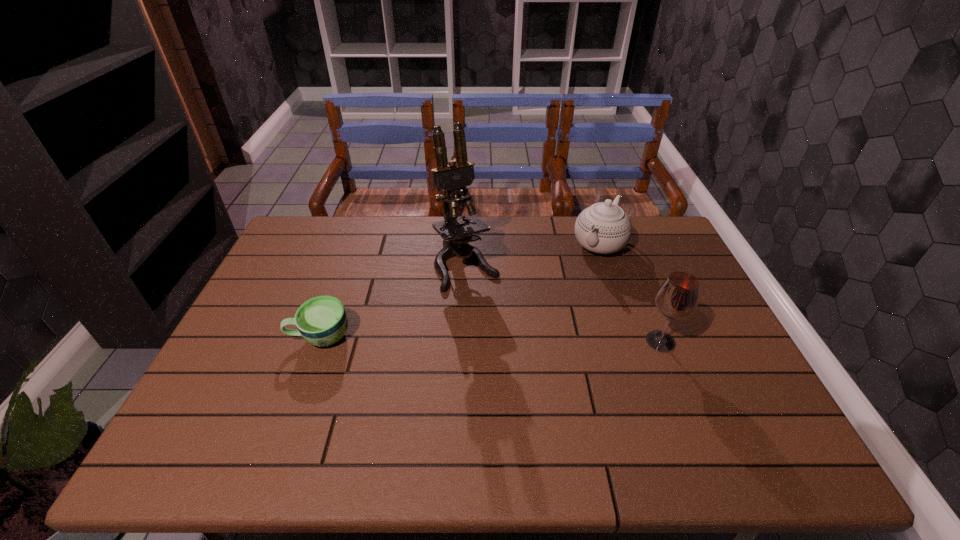
At what (x,y) coordinates should I click in order to perform the action: click on free space located 0.130m on the spout of the chinaware. Please return your answer as a coordinate pair (x, y). Looking at the image, I should click on (572, 284).

What are the coordinates of `free space located 0.110m at the eyepieces of the second object from left to right` in the screenshot? It's located at (493, 315).

Where is `free location located 0.140m at the eyepieces of the second object from left to right`? The image size is (960, 540). free location located 0.140m at the eyepieces of the second object from left to right is located at coordinates (497, 322).

Locate an element on the screen. The width and height of the screenshot is (960, 540). vacant position located at the eyepieces of the second object from left to right is located at coordinates (507, 337).

The height and width of the screenshot is (540, 960). Find the location of `chinaware located at the far edge`. chinaware located at the far edge is located at coordinates (604, 228).

Where is `microscope located at the far edge`? This screenshot has width=960, height=540. microscope located at the far edge is located at coordinates (456, 232).

You are a GUI agent. You are given a task and a screenshot of the screen. Output one action in this format:
    pyautogui.click(x=<x>, y=<y>)
    Task: Click on the object situated at the left edge
    
    Given the screenshot: What is the action you would take?
    pyautogui.click(x=322, y=321)

Locate an element on the screen. object at the right edge is located at coordinates (677, 298).

The image size is (960, 540). What are the coordinates of `vacant space at the far edge of the desktop` in the screenshot? It's located at (331, 252).

Where is `vacant space at the near edge`? The height and width of the screenshot is (540, 960). vacant space at the near edge is located at coordinates (287, 390).